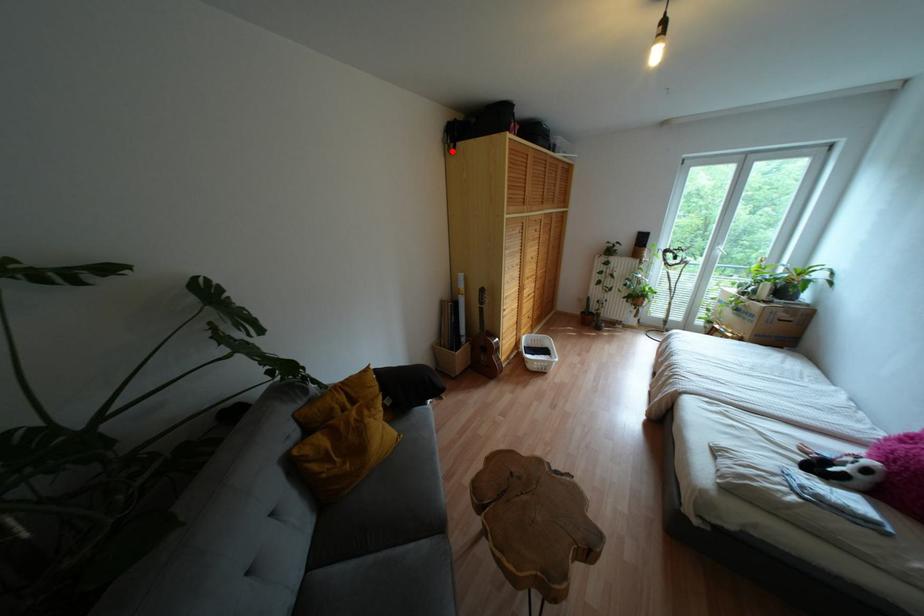
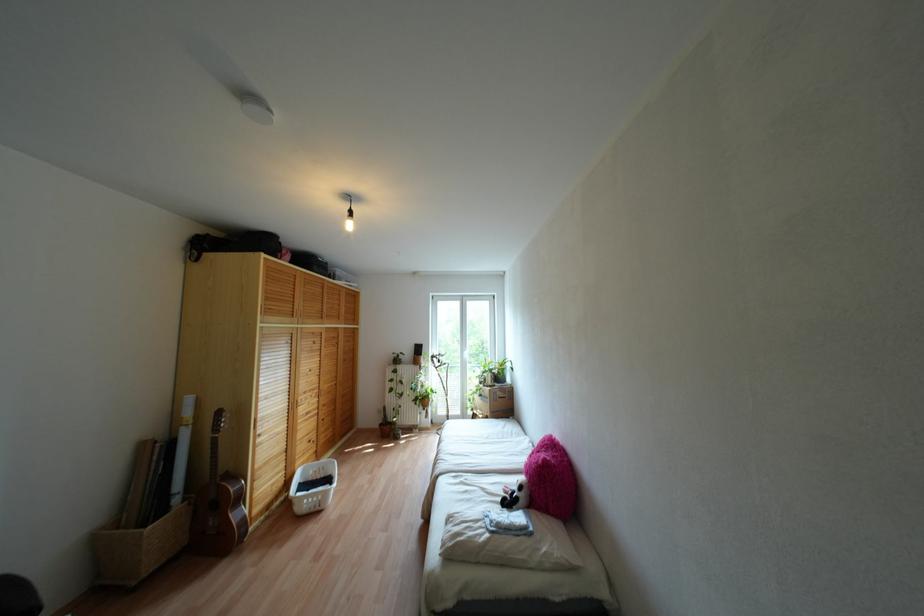
Where in the second image is the point corresponding to the highlighted location from the first image?

(196, 260)